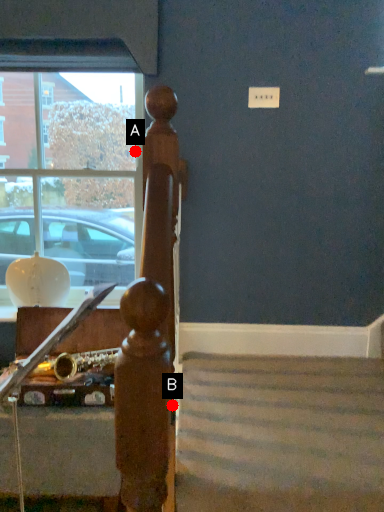
Question: Two points are circled on the image, labeled by A and B beside each circle. Which point appears closest to the camera in this image?

Choices:
 (A) A is closer
 (B) B is closer

Answer: (B)